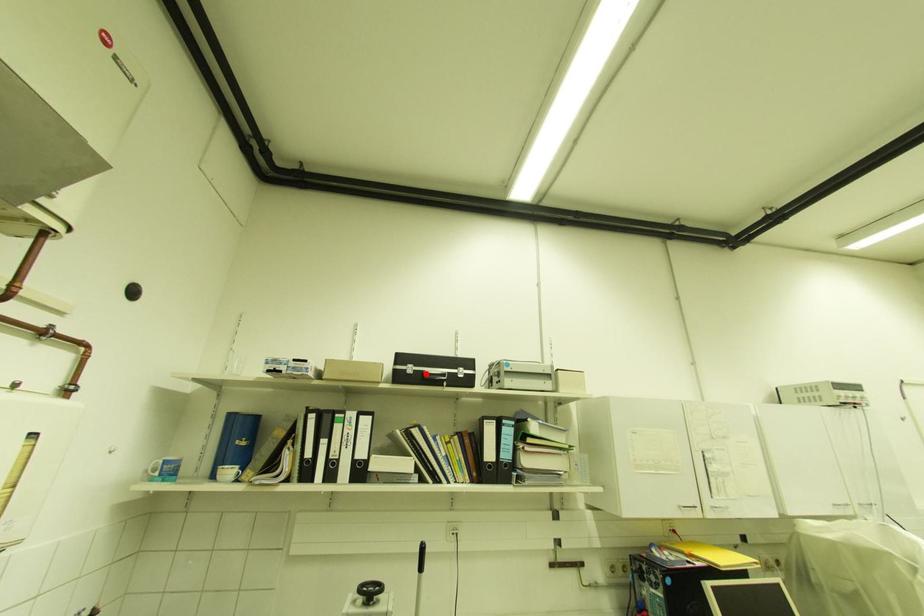
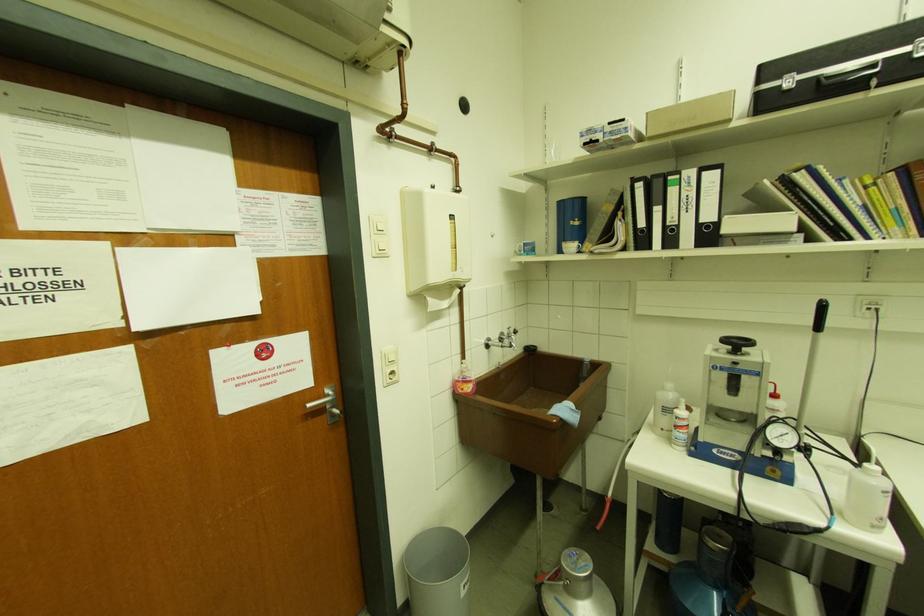
Find the pixel in the second image that matches the highlighted location in the first image.

(821, 79)